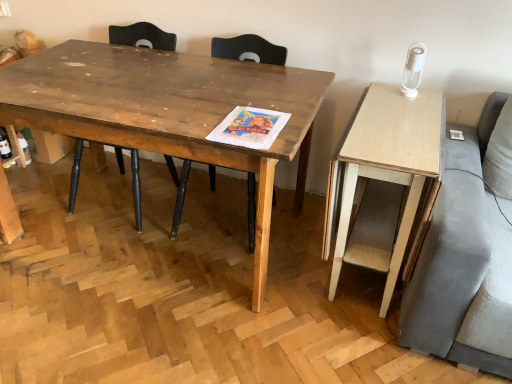
Where is `free point in front of light wood desk at right`? free point in front of light wood desk at right is located at coordinates (342, 350).